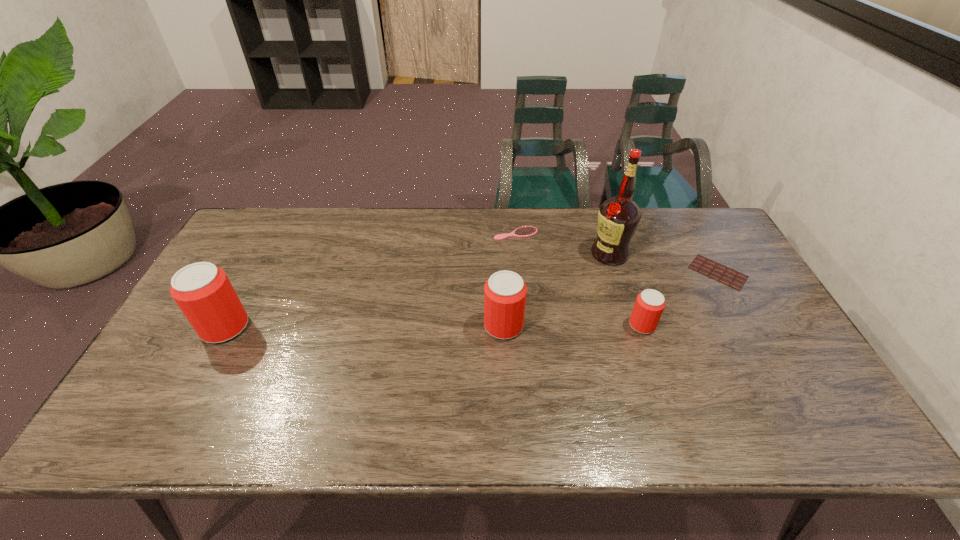
Locate an element on the screen. Image resolution: width=960 pixels, height=540 pixels. free location that satisfies the following two spatial constraints: 1. on the label of the rightmost object; 2. on the right side of the tallest object is located at coordinates (615, 272).

Identify the location of free space that satisfies the following two spatial constraints: 1. on the back side of the chocolate bar; 2. on the right side of the leftmost object. The height and width of the screenshot is (540, 960). coord(254,272).

Where is `blank space that satisfies the following two spatial constraints: 1. on the back side of the third shortest object; 2. on the left side of the fourth shortest object`? blank space that satisfies the following two spatial constraints: 1. on the back side of the third shortest object; 2. on the left side of the fourth shortest object is located at coordinates (503, 325).